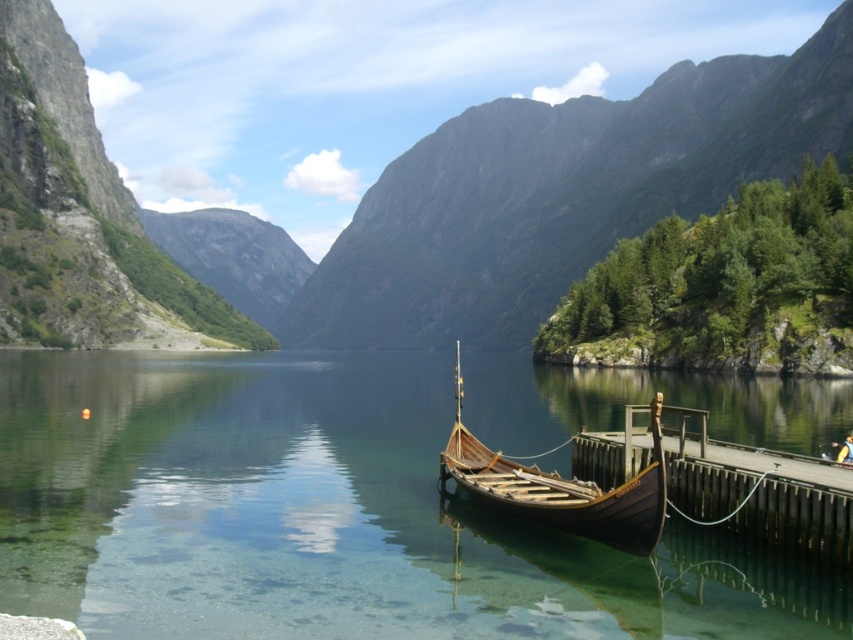
Question: Does transparent water at boat right appear over brown wooden dock at lower right?

Choices:
 (A) no
 (B) yes

Answer: (B)

Question: Which point is closer to the camera?

Choices:
 (A) (346, 433)
 (B) (590, 259)

Answer: (A)

Question: Is brown wooden dock at lower right in front of wooden viking ship at center?

Choices:
 (A) yes
 (B) no

Answer: (A)

Question: Considering the relative positions of rocky cliff at center and brown wooden dock at lower right in the image provided, where is rocky cliff at center located with respect to brown wooden dock at lower right?

Choices:
 (A) right
 (B) left

Answer: (B)

Question: Which point is closer to the camera?

Choices:
 (A) brown wooden dock at lower right
 (B) wooden viking ship at center

Answer: (A)

Question: Estimate the real-world distances between objects in this image. Which object is farther from the wooden viking ship at center?

Choices:
 (A) rocky cliff at center
 (B) transparent water at boat right
 (C) brown wooden dock at lower right

Answer: (A)